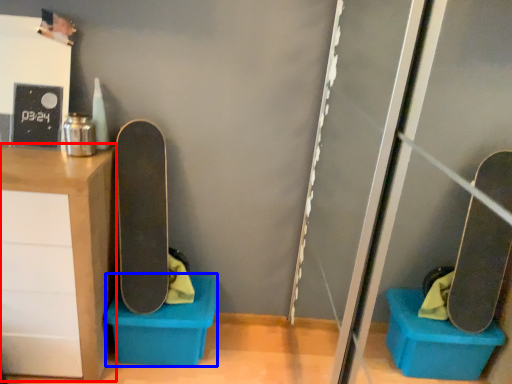
Question: Which object appears closest to the camera in this image, furniture (highlighted by a red box) or storage box (highlighted by a blue box)?

Choices:
 (A) furniture
 (B) storage box

Answer: (A)